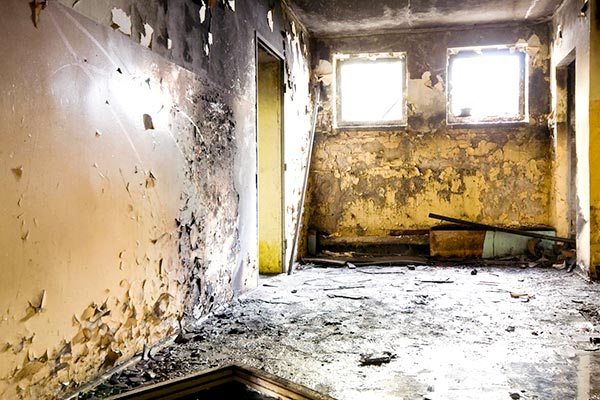
In order to click on doorway in this screenshot , I will do `click(276, 138)`, `click(569, 126)`.